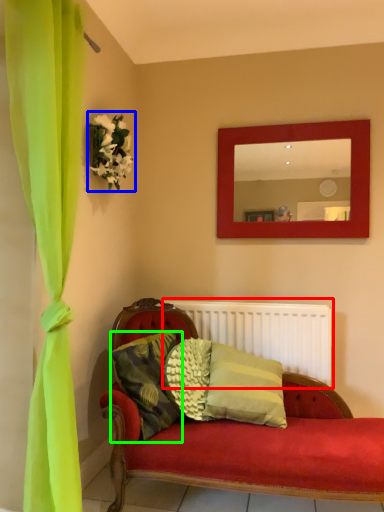
Question: Estimate the real-world distances between objects in this image. Which object is closer to radiator (highlighted by a red box), floral arrangement (highlighted by a blue box) or pillow (highlighted by a green box)?

Choices:
 (A) floral arrangement
 (B) pillow

Answer: (B)